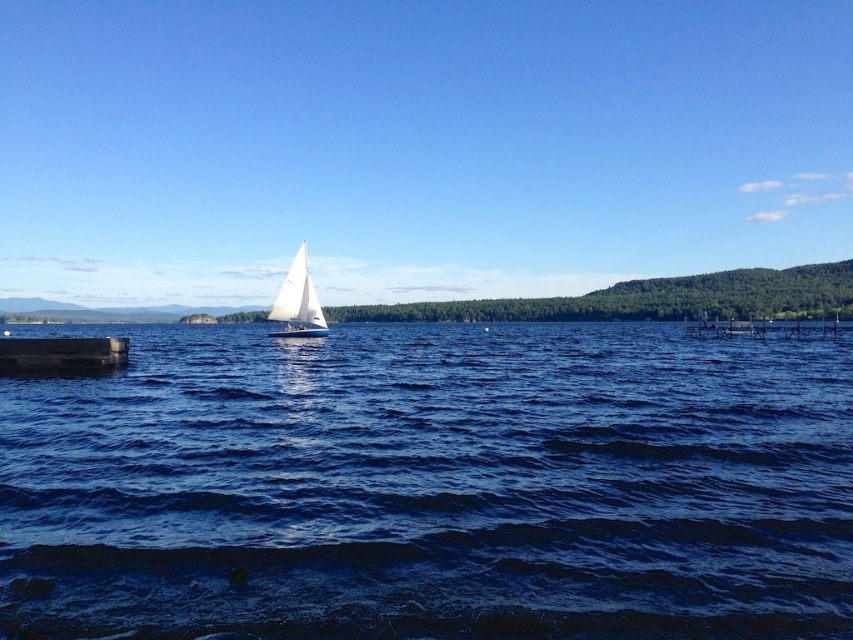
You are standing on the lakeside dock and see the blue water at center and the white matte sailboat at center. Which object is closer to you?

The blue water at center is closer to you because it is in front of the white matte sailboat at center.